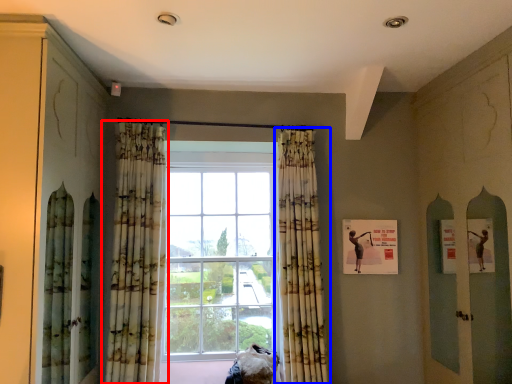
Question: Among these objects, which one is nearest to the camera, curtain (highlighted by a red box) or curtain (highlighted by a blue box)?

Choices:
 (A) curtain
 (B) curtain

Answer: (A)